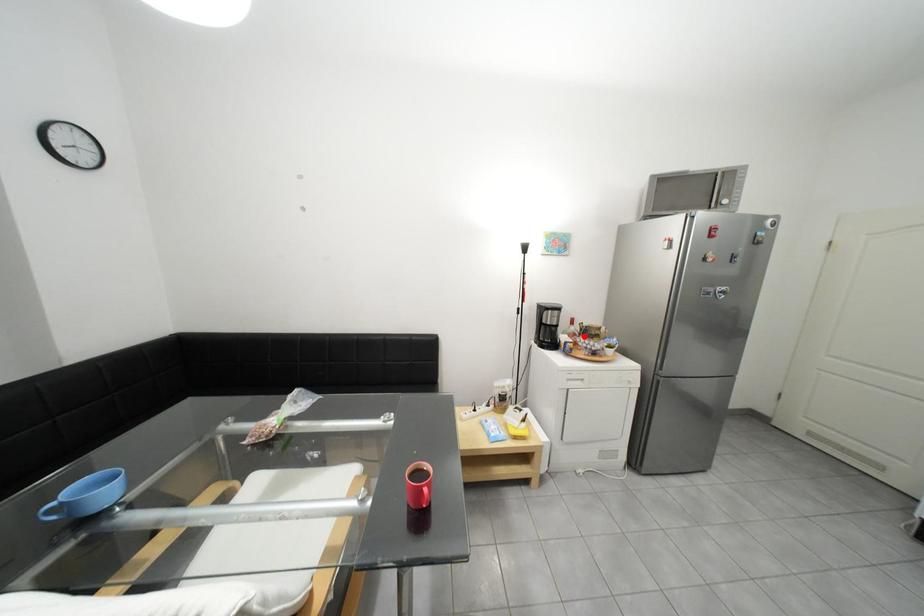
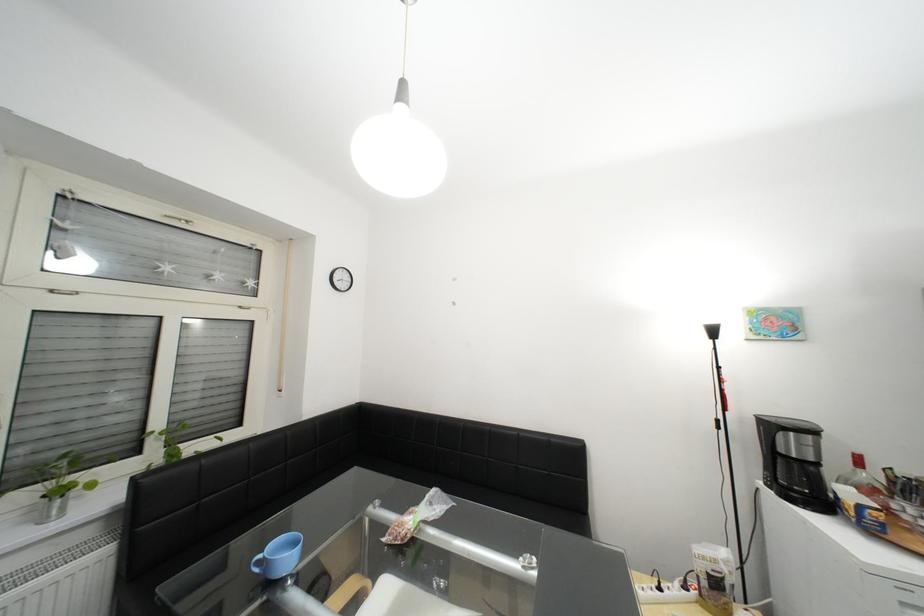
Find the pixel in the second image that matches the highlighted location in the first image.

(881, 492)